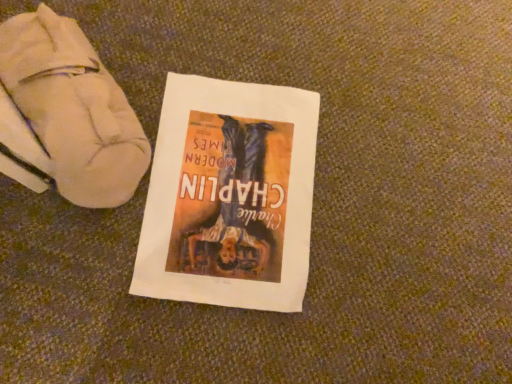
Question: Should I look upward or downward to see white fabric boot at upper left?

Choices:
 (A) down
 (B) up

Answer: (B)